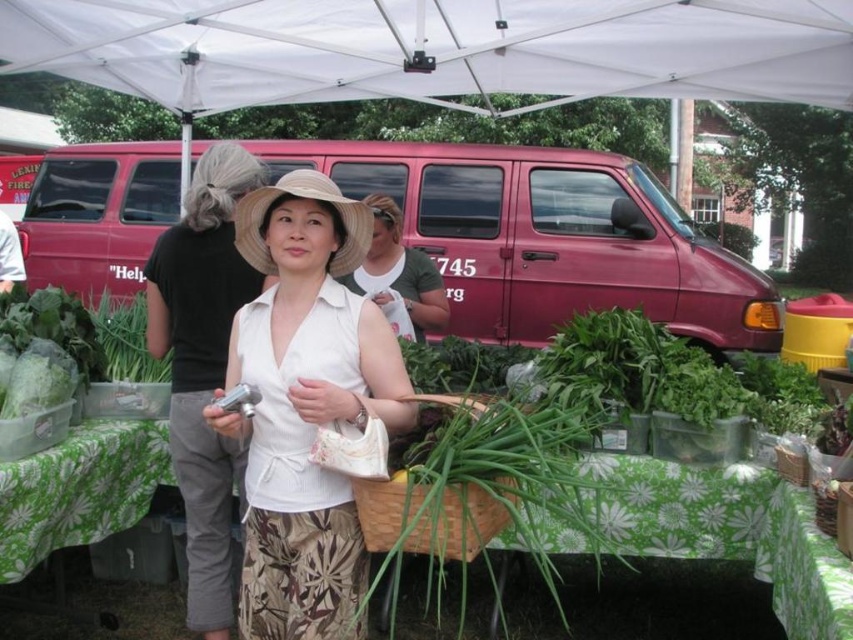
Question: Can you confirm if white fabric canopy at upper center is positioned to the right of green floral tablecloth at lower left?

Choices:
 (A) no
 (B) yes

Answer: (B)

Question: Considering the real-world distances, which object is closest to the white matte dress at center?

Choices:
 (A) green floral tablecloth at lower left
 (B) white fabric canopy at upper center
 (C) white matte hat at upper center
 (D) beige straw hat at center

Answer: (D)

Question: Does white fabric canopy at upper center have a smaller size compared to white matte hat at upper center?

Choices:
 (A) yes
 (B) no

Answer: (B)

Question: Estimate the real-world distances between objects in this image. Which object is farther from the green floral tablecloth at lower left?

Choices:
 (A) white matte dress at center
 (B) white fabric canopy at upper center
 (C) white matte hat at upper center

Answer: (B)

Question: Can you confirm if white fabric canopy at upper center is wider than green floral tablecloth at lower left?

Choices:
 (A) yes
 (B) no

Answer: (A)

Question: Which of the following is the closest to the observer?

Choices:
 (A) [x=351, y=240]
 (B) [x=206, y=310]

Answer: (A)